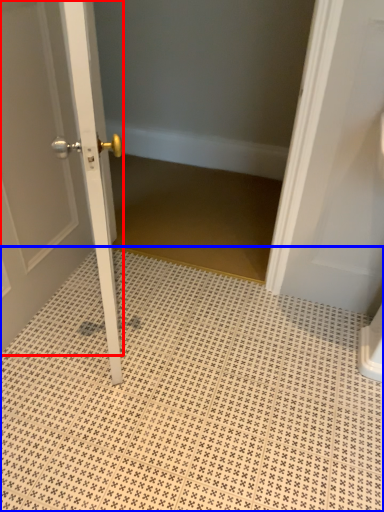
Question: Which point is closer to the camera, door (highlighted by a red box) or ceramic tile (highlighted by a blue box)?

Choices:
 (A) door
 (B) ceramic tile

Answer: (A)